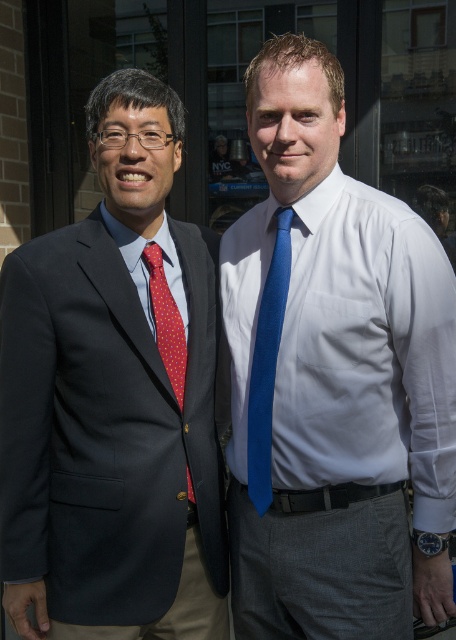
Question: Which of these objects is positioned closest to the matte black suit at left?

Choices:
 (A) blue silk tie at center
 (B) blue smooth tie at center

Answer: (B)

Question: Is blue smooth tie at center below blue silk tie at center?

Choices:
 (A) no
 (B) yes

Answer: (A)

Question: Which point is closer to the camera?

Choices:
 (A) matte black suit at left
 (B) blue smooth tie at center
 (C) red dotted fabric tie at left

Answer: (B)

Question: Which point is farther from the camera taking this photo?

Choices:
 (A) (248, 400)
 (B) (393, 577)
 (C) (179, 378)
 (D) (34, 560)

Answer: (C)

Question: Is matte black suit at left positioned behind red dotted fabric tie at left?

Choices:
 (A) yes
 (B) no

Answer: (B)

Question: Does blue silk tie at center appear on the right side of red dotted fabric tie at left?

Choices:
 (A) no
 (B) yes

Answer: (B)